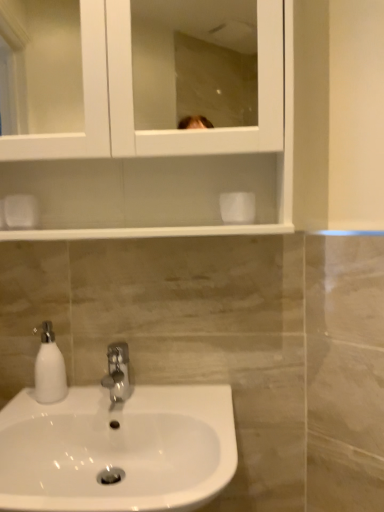
Find the location of a particular element. The height and width of the screenshot is (512, 384). vacant space in front of white glossy soap dispenser at lower left is located at coordinates (34, 412).